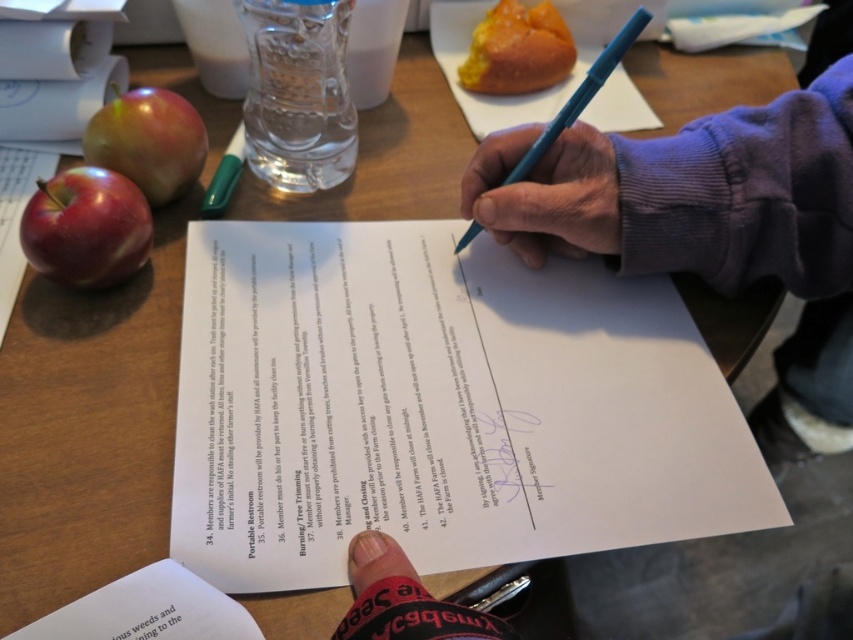
Which is more to the left, smooth blue pen at center or shiny red apple at upper left?

shiny red apple at upper left

Does smooth blue pen at center appear under shiny red apple at upper left?

Yes, smooth blue pen at center is below shiny red apple at upper left.

Identify the location of smooth blue pen at center. (546, 193).

The image size is (853, 640). In order to click on smooth blue pen at center in this screenshot , I will do point(546,193).

Can you confirm if shiny red apple at left is positioned to the right of blue plastic pen at upper center?

In fact, shiny red apple at left is to the left of blue plastic pen at upper center.

Is point (97, 227) positioned behind point (613, 42)?

No, it is not.

This screenshot has height=640, width=853. Identify the location of shiny red apple at left. (86, 228).

Can you confirm if shiny red apple at left is positioned to the right of black paper at lower left?

Incorrect, shiny red apple at left is not on the right side of black paper at lower left.

Is shiny red apple at left below black paper at lower left?

No.

Does point (64, 248) lie behind point (178, 628)?

Yes, it is.

Where is `shiny red apple at left`? The width and height of the screenshot is (853, 640). shiny red apple at left is located at coordinates (86, 228).